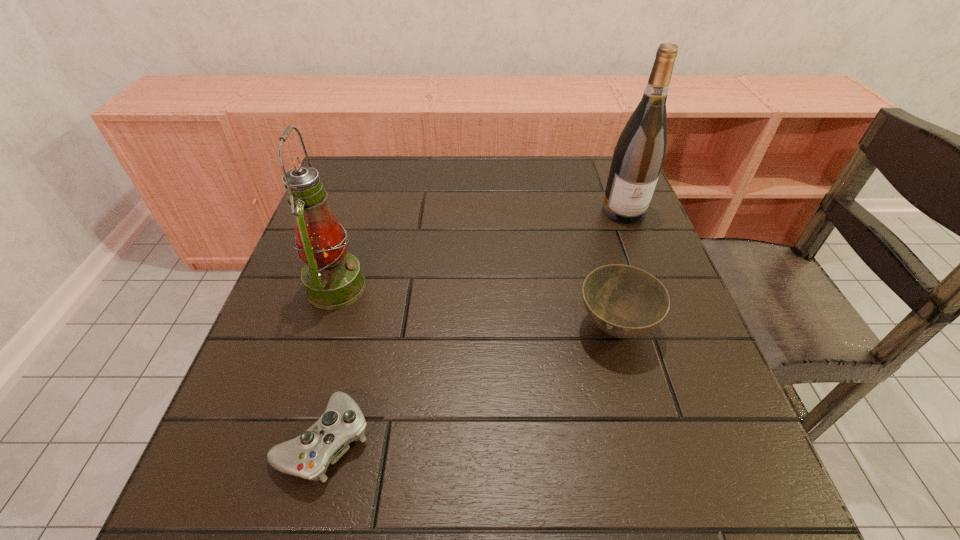
I want to click on the farthest object, so click(x=639, y=154).

What are the coordinates of `oil lamp` in the screenshot? It's located at point(332,278).

Where is `bowl`? This screenshot has width=960, height=540. bowl is located at coordinates (624, 301).

Locate an element on the screen. This screenshot has height=540, width=960. the shortest object is located at coordinates (308, 456).

Find the location of a particular element. control is located at coordinates (308, 456).

Locate an element on the screen. vacant space located 0.350m on the label of the farthest object is located at coordinates (673, 340).

What are the coordinates of `free spot located on the front of the oil lamp` in the screenshot? It's located at (x=310, y=368).

This screenshot has height=540, width=960. Find the location of `free spot located 0.210m on the left of the third tallest object`. free spot located 0.210m on the left of the third tallest object is located at coordinates (468, 327).

At what (x,y) coordinates should I click in order to perform the action: click on vacant region located on the back of the nearest object. Please return your answer as a coordinate pair (x, y). This screenshot has width=960, height=540. Looking at the image, I should click on (366, 278).

Where is `object located in the far edge section of the desktop`? This screenshot has width=960, height=540. object located in the far edge section of the desktop is located at coordinates (639, 154).